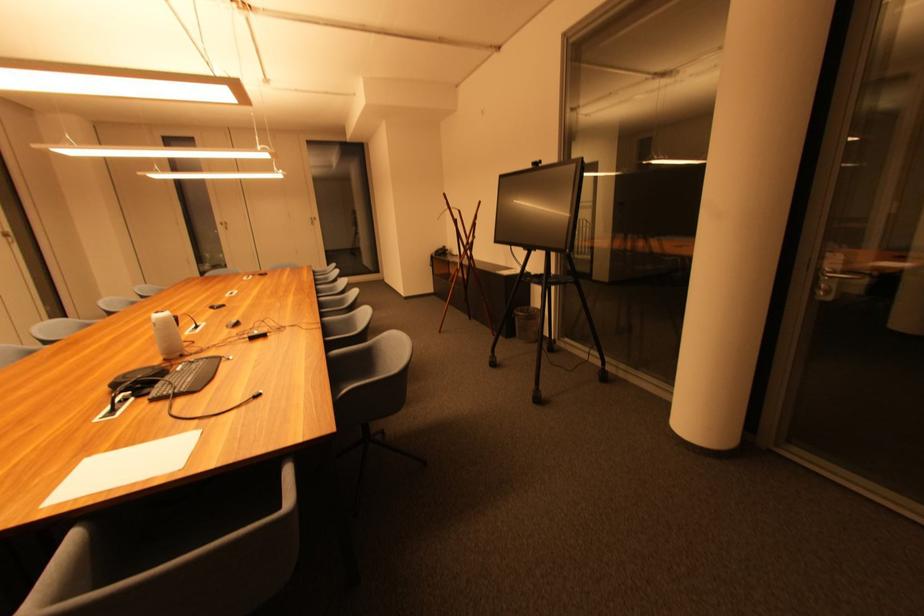
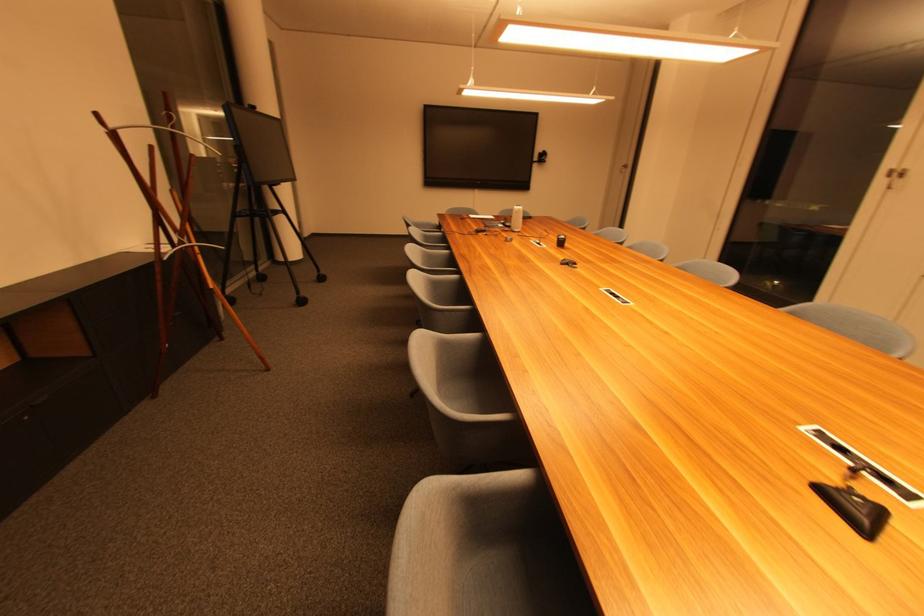
Where in the second image is the point corresponding to point (455, 282) from the first image?

(216, 288)